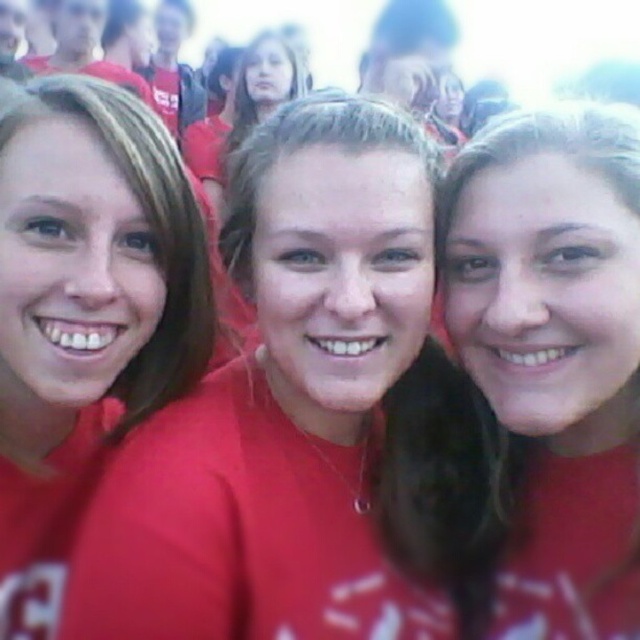
Question: Which object appears closest to the camera in this image?

Choices:
 (A) matte red shirt at left
 (B) matte red shirt at center

Answer: (B)

Question: Is matte red shirt at center below matte red shirt at left?

Choices:
 (A) yes
 (B) no

Answer: (A)

Question: Does matte red shirt at center come in front of matte red shirt at left?

Choices:
 (A) no
 (B) yes

Answer: (B)

Question: Which point is farther to the camera?

Choices:
 (A) (552, 333)
 (B) (113, 358)

Answer: (B)

Question: Does matte red shirt at center lie behind matte red shirt at left?

Choices:
 (A) yes
 (B) no

Answer: (B)

Question: Which of the following is the farthest from the observer?

Choices:
 (A) (582, 262)
 (B) (67, 477)

Answer: (B)